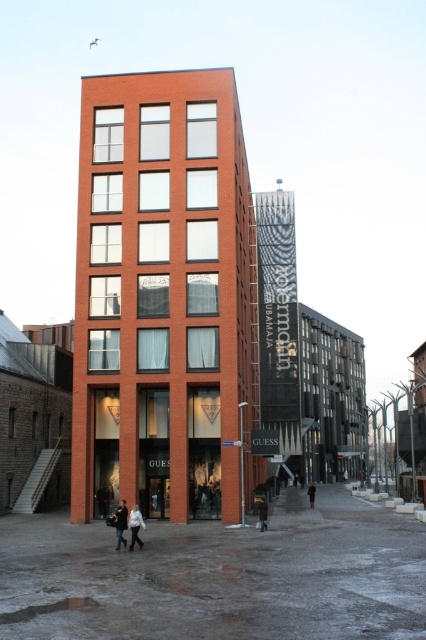
You are a delivery person needing to place a small package on the ground between the white cotton jacket at lower center and the dark brown leather coat at lower center. Can you fit it there?

The white cotton jacket at lower center occupies less space than the dark brown leather coat at lower center, so there is enough space between them to place a small package.

You are a delivery person standing at the entrance of the GUESS store. You need to place a white matte jacket at lower center and a dark brown leather coat at lower center in a storage room that is 40 meters wide. Can both items be placed side by side without overlapping?

The white matte jacket at lower center and dark brown leather coat at lower center are 39.23 meters apart from each other. Since the storage room is 40 meters wide, there is enough space to place both items side by side without overlapping.